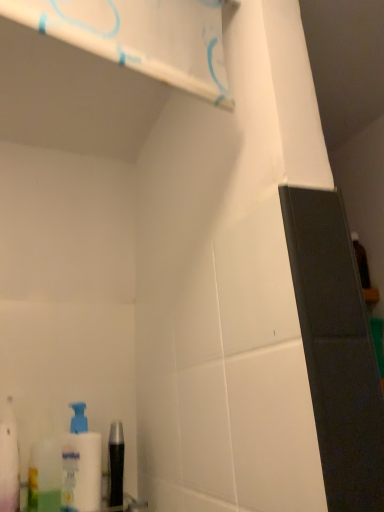
Question: Is white plastic pump bottle at lower left bigger than white plastic bottle at lower left?

Choices:
 (A) no
 (B) yes

Answer: (A)

Question: From the image's perspective, does white plastic pump bottle at lower left appear higher than white plastic bottle at lower left?

Choices:
 (A) no
 (B) yes

Answer: (A)

Question: Does white plastic pump bottle at lower left have a greater width compared to white plastic bottle at lower left?

Choices:
 (A) yes
 (B) no

Answer: (B)

Question: Could you tell me if white plastic pump bottle at lower left is facing white plastic bottle at lower left?

Choices:
 (A) yes
 (B) no

Answer: (B)

Question: Is white plastic pump bottle at lower left located outside white plastic bottle at lower left?

Choices:
 (A) yes
 (B) no

Answer: (A)

Question: Is translucent plastic mouthwash at lower left, acting as the 1th mouthwash starting from the left, to the left or to the right of black glossy mouthwash at lower left, positioned as the first mouthwash in right-to-left order, in the image?

Choices:
 (A) left
 (B) right

Answer: (A)

Question: Is translucent plastic mouthwash at lower left, the 2th mouthwash viewed from the right, situated inside black glossy mouthwash at lower left, positioned as the first mouthwash in right-to-left order, or outside?

Choices:
 (A) inside
 (B) outside

Answer: (B)

Question: From the image's perspective, relative to black glossy mouthwash at lower left, positioned as the first mouthwash in right-to-left order, is translucent plastic mouthwash at lower left, acting as the 1th mouthwash starting from the left, above or below?

Choices:
 (A) below
 (B) above

Answer: (B)

Question: In terms of height, does translucent plastic mouthwash at lower left, the 2th mouthwash viewed from the right, look taller or shorter compared to black glossy mouthwash at lower left, the 2th mouthwash in the left-to-right sequence?

Choices:
 (A) short
 (B) tall

Answer: (B)

Question: From a real-world perspective, is translucent plastic mouthwash at lower left, acting as the 1th mouthwash starting from the left, above or below white plastic pump bottle at lower left?

Choices:
 (A) above
 (B) below

Answer: (A)

Question: Is translucent plastic mouthwash at lower left, the 2th mouthwash viewed from the right, in front of or behind white plastic pump bottle at lower left in the image?

Choices:
 (A) behind
 (B) front

Answer: (B)

Question: From their relative heights in the image, would you say translucent plastic mouthwash at lower left, acting as the 1th mouthwash starting from the left, is taller or shorter than white plastic pump bottle at lower left?

Choices:
 (A) tall
 (B) short

Answer: (A)

Question: In terms of width, does translucent plastic mouthwash at lower left, the 2th mouthwash viewed from the right, look wider or thinner when compared to white plastic pump bottle at lower left?

Choices:
 (A) thin
 (B) wide

Answer: (B)

Question: Considering the positions of translucent plastic mouthwash at lower left, acting as the 1th mouthwash starting from the left, and white plastic bottle at lower left in the image, is translucent plastic mouthwash at lower left, acting as the 1th mouthwash starting from the left, taller or shorter than white plastic bottle at lower left?

Choices:
 (A) tall
 (B) short

Answer: (B)

Question: In the image, is translucent plastic mouthwash at lower left, the 2th mouthwash viewed from the right, positioned in front of or behind white plastic bottle at lower left?

Choices:
 (A) behind
 (B) front

Answer: (A)